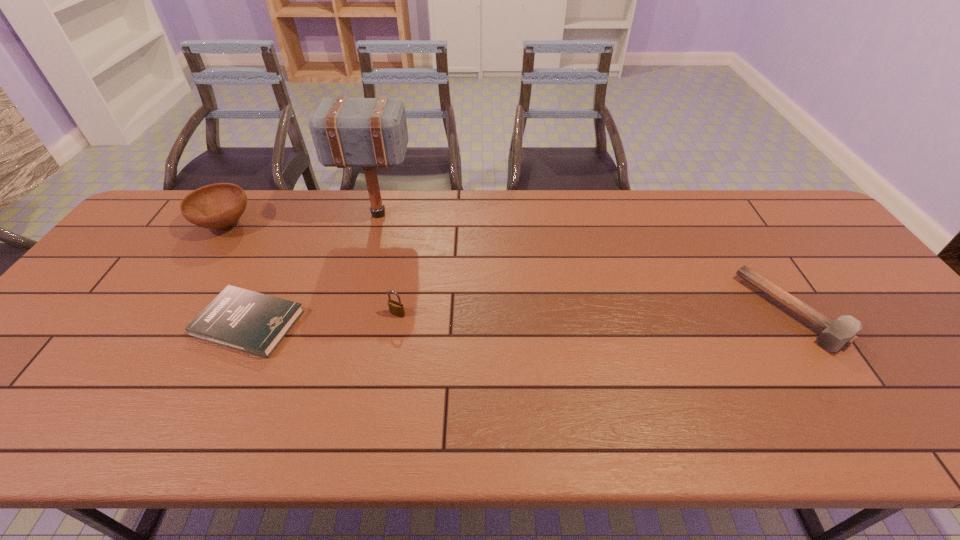
I want to click on vacant region located on the back of the third tallest object, so click(405, 269).

The width and height of the screenshot is (960, 540). Find the location of `vacant region located 0.140m on the left of the shorter mallet`. vacant region located 0.140m on the left of the shorter mallet is located at coordinates pyautogui.click(x=697, y=311).

At what (x,y) coordinates should I click in order to perform the action: click on vacant space situated 0.390m on the back of the second object from left to right. Please return your answer as a coordinate pair (x, y). The width and height of the screenshot is (960, 540). Looking at the image, I should click on (304, 206).

Where is `mallet that is at the far edge`? mallet that is at the far edge is located at coordinates (347, 132).

The image size is (960, 540). Identify the location of bowl that is positioned at the far edge. (215, 206).

Where is `object present at the right edge`? object present at the right edge is located at coordinates (835, 335).

The height and width of the screenshot is (540, 960). Identify the location of vacant space at the far edge of the desktop. (673, 217).

Identify the location of vacant position at the near edge of the desktop. This screenshot has height=540, width=960. (882, 406).

In the image, there is a desktop. At what (x,y) coordinates should I click in order to perform the action: click on vacant space at the left edge. Please return your answer as a coordinate pair (x, y). This screenshot has width=960, height=540. Looking at the image, I should click on (41, 369).

I want to click on free space at the right edge of the desktop, so click(874, 303).